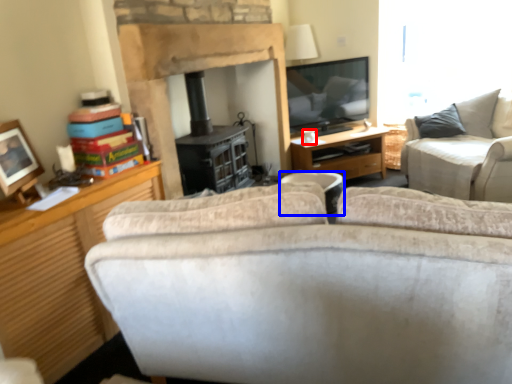
Question: Which object is further to the camera taking this photo, coffee cup (highlighted by a red box) or trash bin/can (highlighted by a blue box)?

Choices:
 (A) coffee cup
 (B) trash bin/can

Answer: (A)